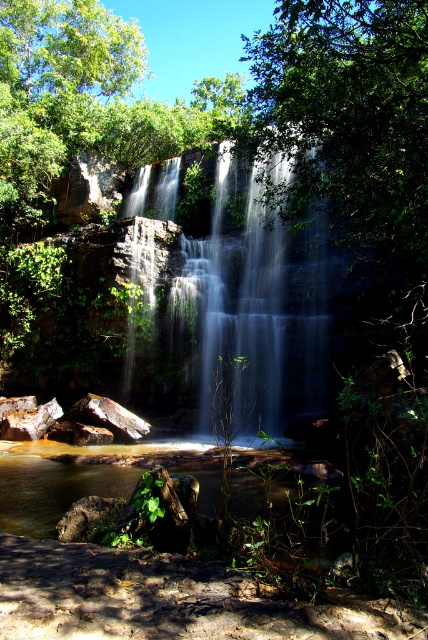
Question: Can you confirm if translucent white water at center is positioned above clear water at center?

Choices:
 (A) yes
 (B) no

Answer: (A)

Question: Can you confirm if translucent white water at center is positioned to the left of clear water at center?

Choices:
 (A) no
 (B) yes

Answer: (A)

Question: Which point is farther to the camera?

Choices:
 (A) clear water at center
 (B) translucent white water at center

Answer: (B)

Question: Which point is closer to the camera?

Choices:
 (A) (205, 513)
 (B) (324, 298)

Answer: (A)

Question: Does translucent white water at center have a lesser width compared to clear water at center?

Choices:
 (A) no
 (B) yes

Answer: (A)

Question: Which point is farther to the camera?

Choices:
 (A) translucent white water at center
 (B) clear water at center

Answer: (A)